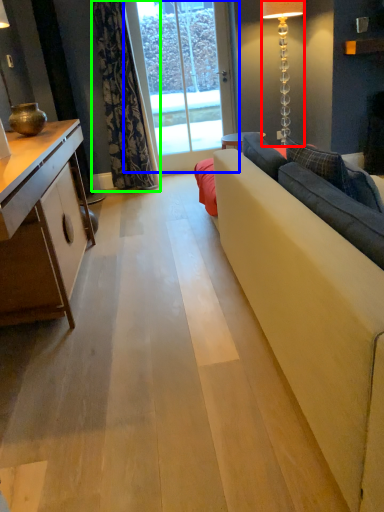
Question: Considering the real-world distances, which object is farthest from lamp (highlighted by a red box)? window screen (highlighted by a blue box) or curtain (highlighted by a green box)?

Choices:
 (A) window screen
 (B) curtain

Answer: (B)